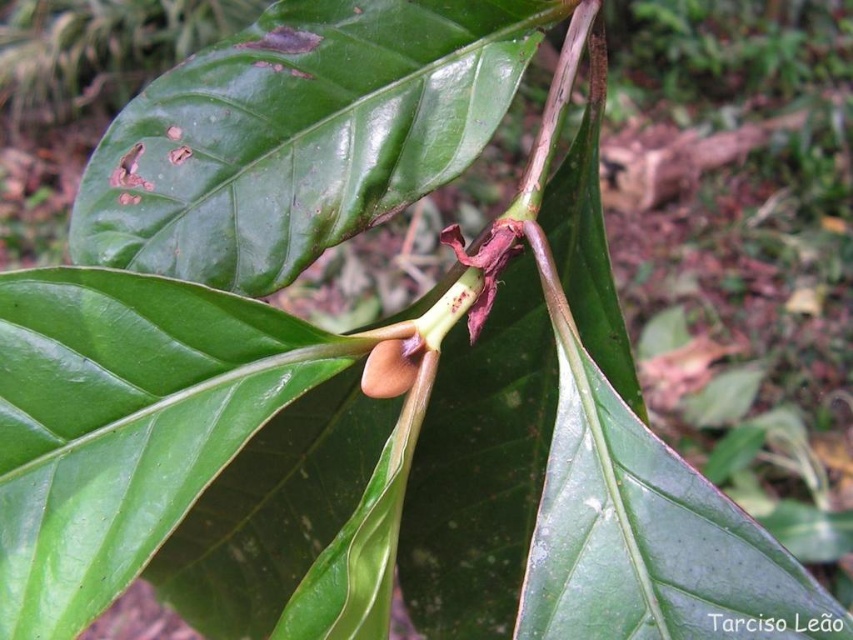
You are a botanist examining a plant. You need to locate the green matte leaf at center. What are its coordinates?

The green matte leaf at center is located at coordinates point (x=299, y=134).

You are a botanist examining the plant. You need to determine the vertical arrangement of the green matte leaf at center and the brown matte pod at center. Which one is positioned higher?

The green matte leaf at center is positioned higher than the brown matte pod at center.

You are standing in a botanical garden and want to examine the green matte leaf at center closely. If your hand is 1 foot wide, can you reach out and touch the leaf without moving closer than your current position?

The distance between you and the green matte leaf at center is 3.59 feet, which is greater than the 1 foot width of your hand. Therefore, you cannot reach the leaf without moving closer.